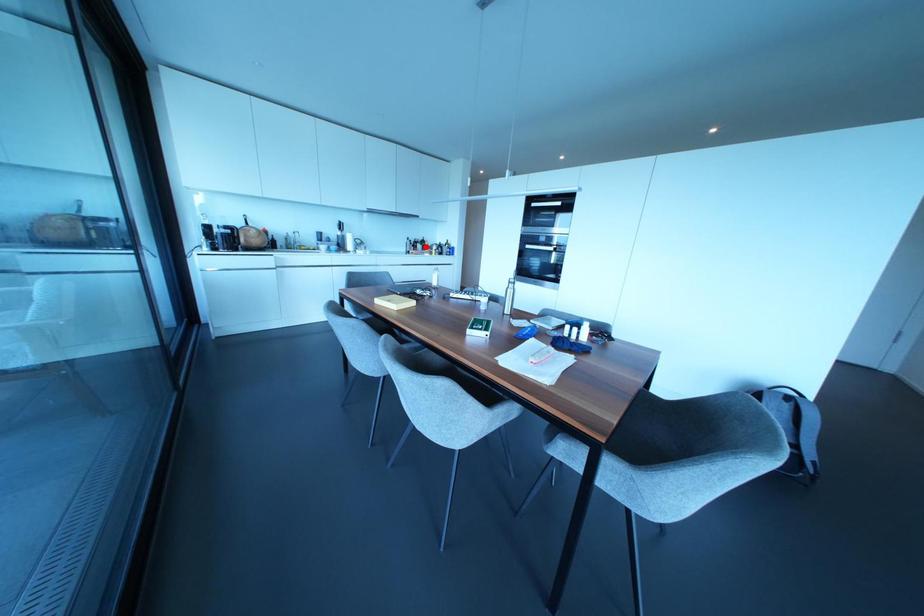
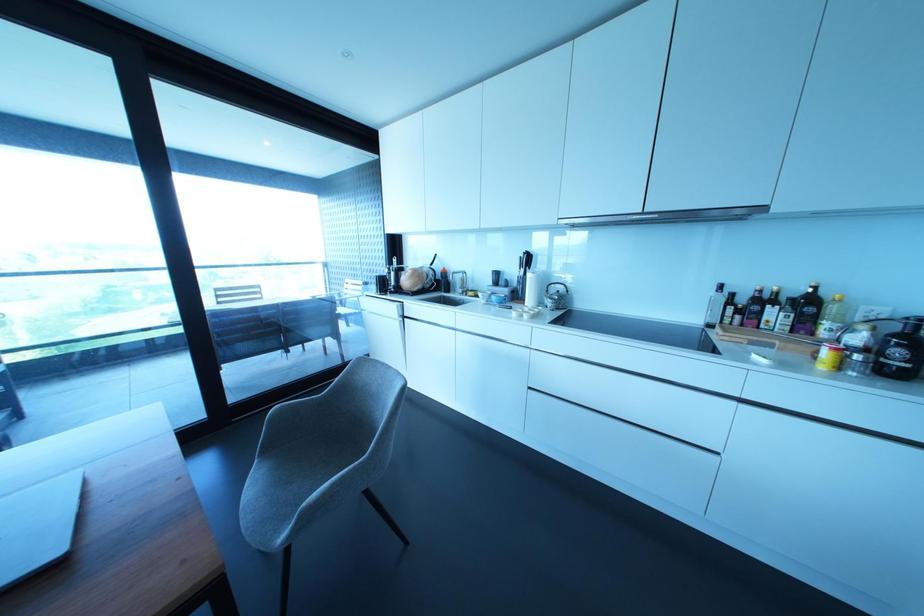
Find the pixel in the second image that matches the highlighted location in the first image.

(825, 323)